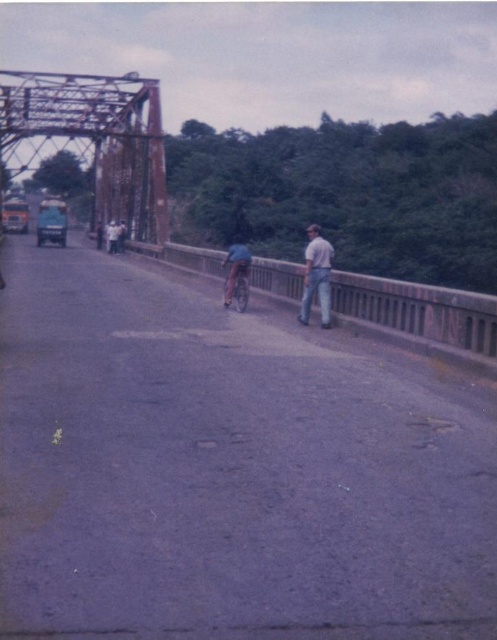
Is metallic green truck at left positioned before light blue denim jacket at center?

No, metallic green truck at left is behind light blue denim jacket at center.

Is metallic green truck at left bigger than light blue denim jacket at center?

Correct, metallic green truck at left is larger in size than light blue denim jacket at center.

Is point (14, 212) closer to camera compared to point (106, 243)?

No, it is behind (106, 243).

I want to click on metallic green truck at left, so click(x=14, y=216).

Is point (237, 284) less distant than point (117, 234)?

Yes, point (237, 284) is in front of point (117, 234).

Can you confirm if shiny blue bicycle at center is thinner than light blue denim jacket at center?

Yes, shiny blue bicycle at center is thinner than light blue denim jacket at center.

You are a GUI agent. You are given a task and a screenshot of the screen. Output one action in this format:
    pyautogui.click(x=<x>, y=<y>)
    Task: Click on the shiny blue bicycle at center
    This screenshot has height=640, width=497.
    Given the screenshot: What is the action you would take?
    pyautogui.click(x=236, y=284)

Which of these two, metallic blue car at left or light blue denim jacket at center, stands shorter?

With less height is light blue denim jacket at center.

Which is behind, point (53, 237) or point (116, 227)?

Positioned behind is point (53, 237).

Image resolution: width=497 pixels, height=640 pixels. I want to click on metallic blue car at left, so click(x=52, y=221).